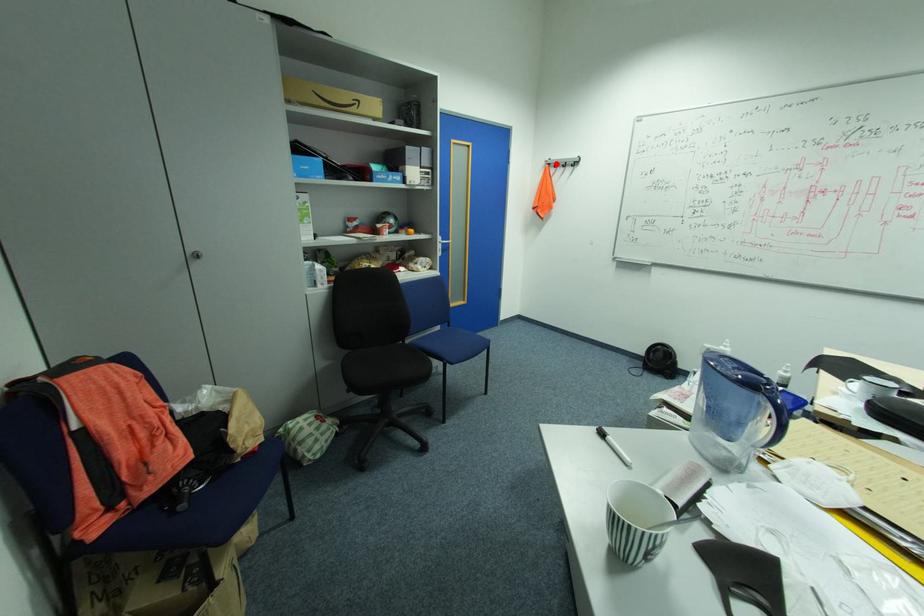
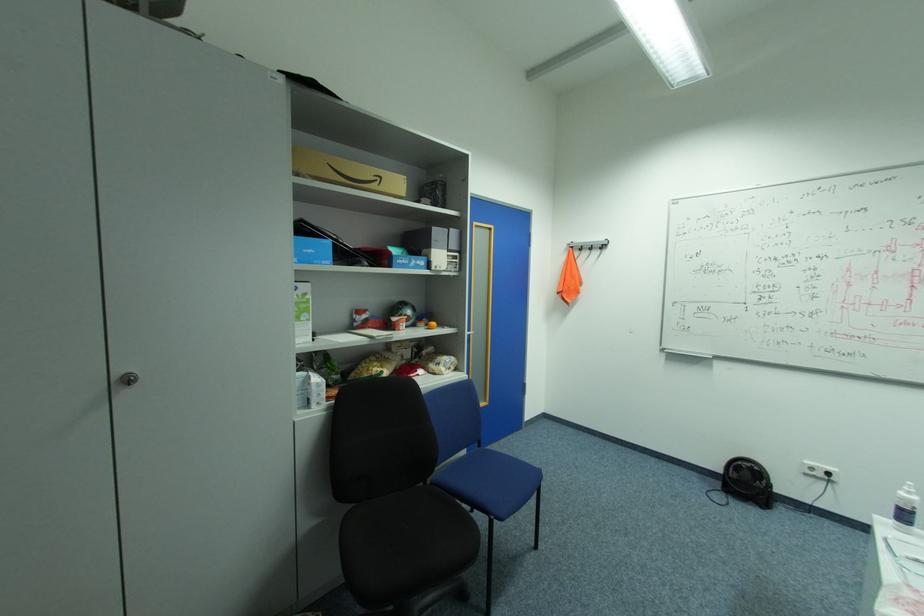
Question: I am providing you with two images of the same scene from different viewpoints. In image1, a red point is highlighted. Considering the same 3D point in image2, which of the following is correct?

Choices:
 (A) It is closer
 (B) It is farther

Answer: (B)